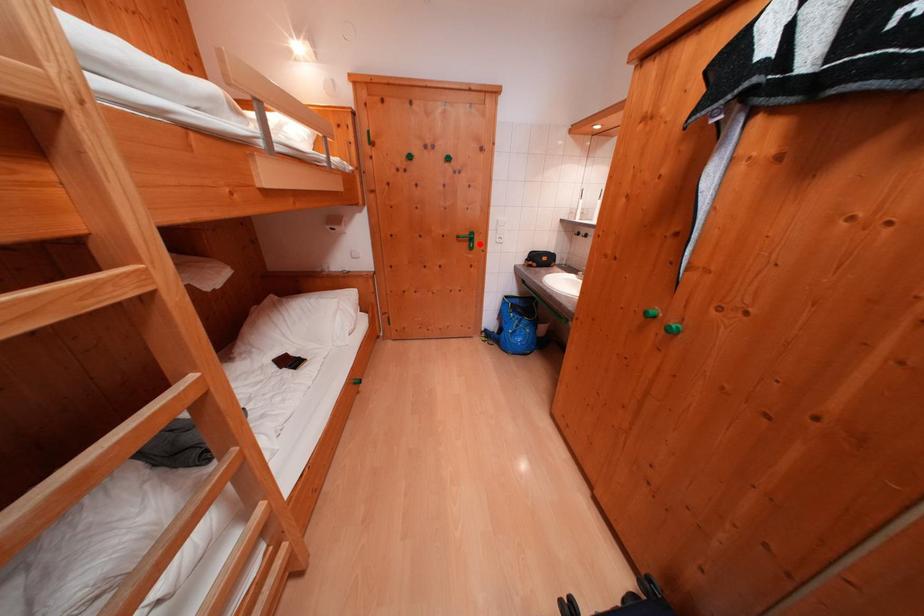
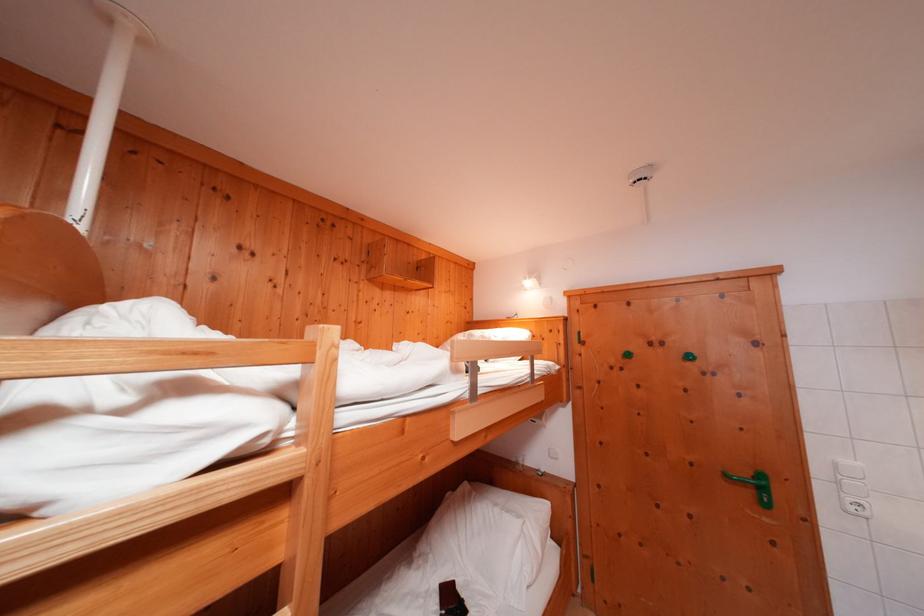
Find the pixel in the second image that matches the highlighted location in the first image.

(771, 493)